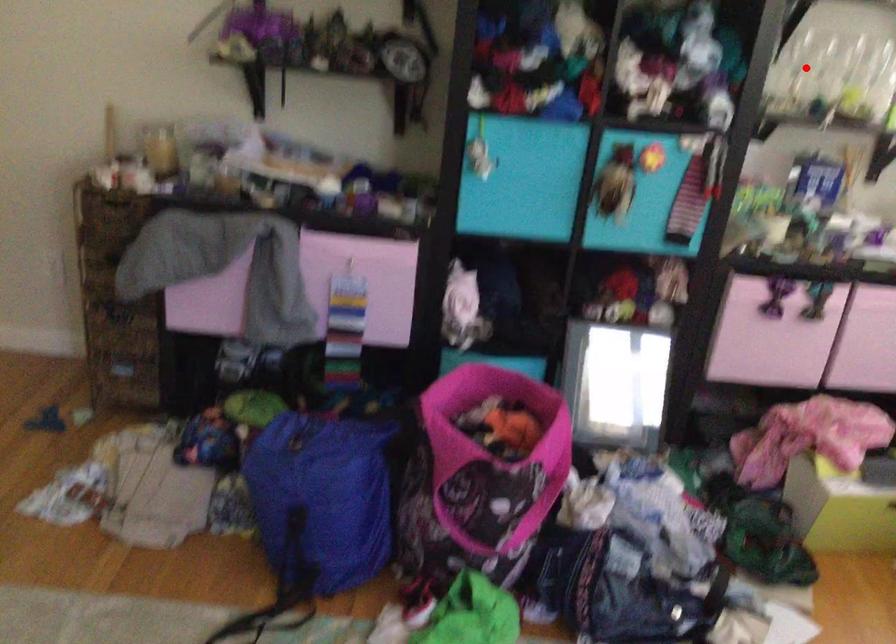
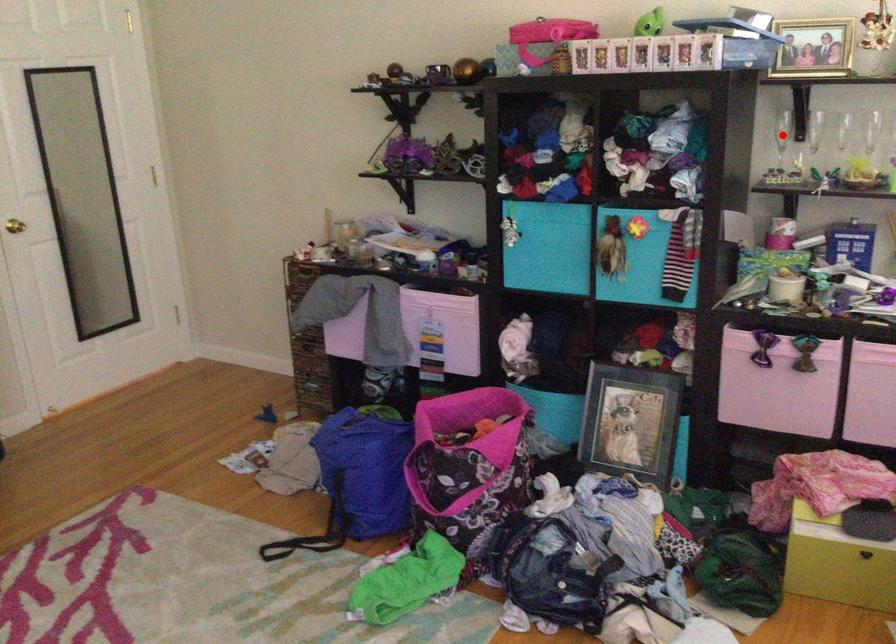
I am providing you with two images of the same scene from different viewpoints. A red point is marked on the first image and another point is marked on the second image. Does the point marked in image1 correspond to the same location as the one in image2?

No